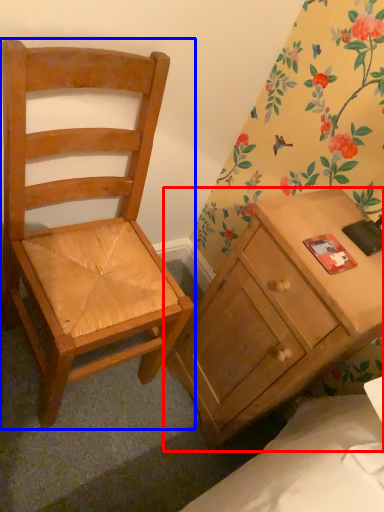
Question: Which point is closer to the camera, desk (highlighted by a red box) or chair (highlighted by a blue box)?

Choices:
 (A) desk
 (B) chair

Answer: (B)